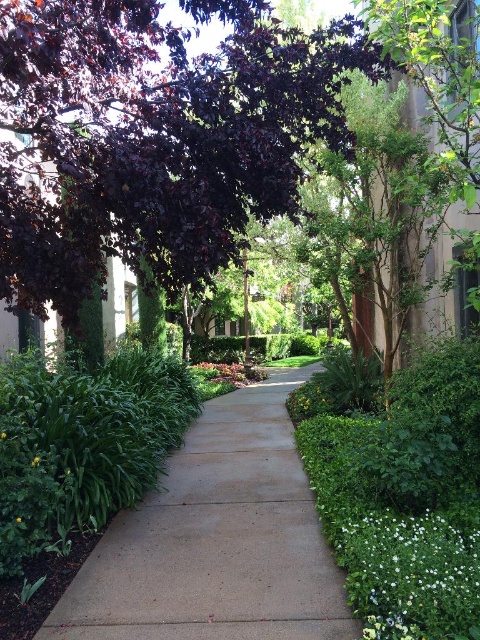
Is purple glossy leaves at upper left to the left of green leafy plant at lower left from the viewer's perspective?

No, purple glossy leaves at upper left is not to the left of green leafy plant at lower left.

Is purple glossy leaves at upper left in front of green leafy plant at lower left?

That is True.

Describe the element at coordinates (156, 134) in the screenshot. I see `purple glossy leaves at upper left` at that location.

Locate an element on the screen. This screenshot has width=480, height=640. purple glossy leaves at upper left is located at coordinates (156, 134).

Does purple glossy leaves at upper left lie in front of green leafy bush at center-left?

Yes, it is in front of green leafy bush at center-left.

Can you confirm if purple glossy leaves at upper left is smaller than green leafy bush at center-left?

No, purple glossy leaves at upper left is not smaller than green leafy bush at center-left.

Which is in front, point (74, 172) or point (38, 419)?

Positioned in front is point (74, 172).

Where is `purple glossy leaves at upper left`? This screenshot has width=480, height=640. purple glossy leaves at upper left is located at coordinates (156, 134).

Between purple glossy leaves at upper left and sandy concrete sidewalk at center, which one is positioned higher?

purple glossy leaves at upper left is higher up.

Based on the photo, between purple glossy leaves at upper left and sandy concrete sidewalk at center, which one is positioned lower?

sandy concrete sidewalk at center

What do you see at coordinates (156, 134) in the screenshot? I see `purple glossy leaves at upper left` at bounding box center [156, 134].

Find the location of a particular element. This screenshot has height=640, width=480. purple glossy leaves at upper left is located at coordinates tap(156, 134).